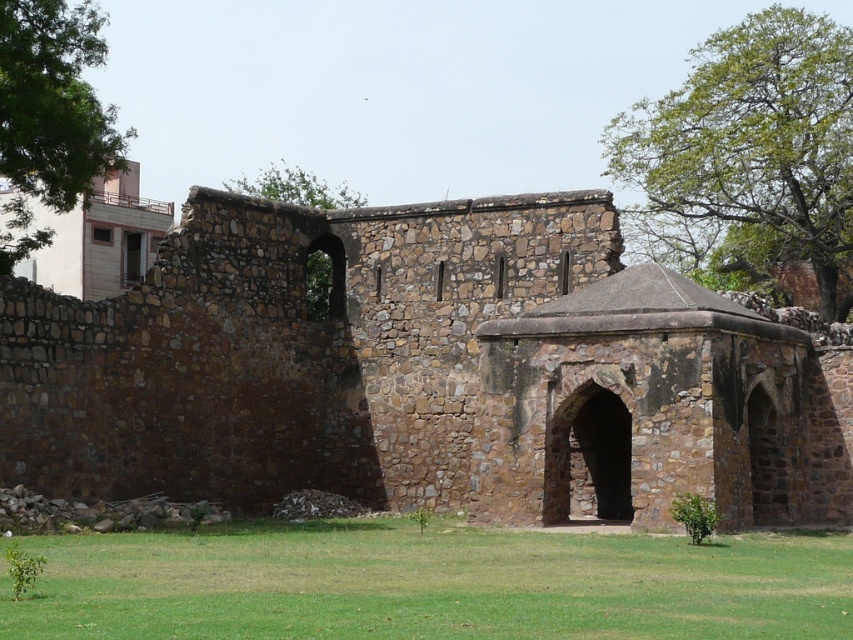
Question: Estimate the real-world distances between objects in this image. Which object is farther from the green leafy tree at upper center?

Choices:
 (A) green leafy tree at upper right
 (B) green leafy tree at upper left
 (C) green grass at lower center
 (D) rustic stone church at center

Answer: (C)

Question: Which is farther from the green leafy tree at upper left?

Choices:
 (A) green leafy tree at upper center
 (B) green leafy tree at upper right

Answer: (B)

Question: Is rustic stone church at center bigger than green grass at lower center?

Choices:
 (A) no
 (B) yes

Answer: (B)

Question: Is rustic stone church at center smaller than green leafy tree at upper right?

Choices:
 (A) no
 (B) yes

Answer: (B)

Question: Which point is closer to the camera taking this photo?

Choices:
 (A) (15, 64)
 (B) (704, 260)

Answer: (A)

Question: Does green leafy tree at upper left appear under green leafy tree at upper center?

Choices:
 (A) yes
 (B) no

Answer: (B)